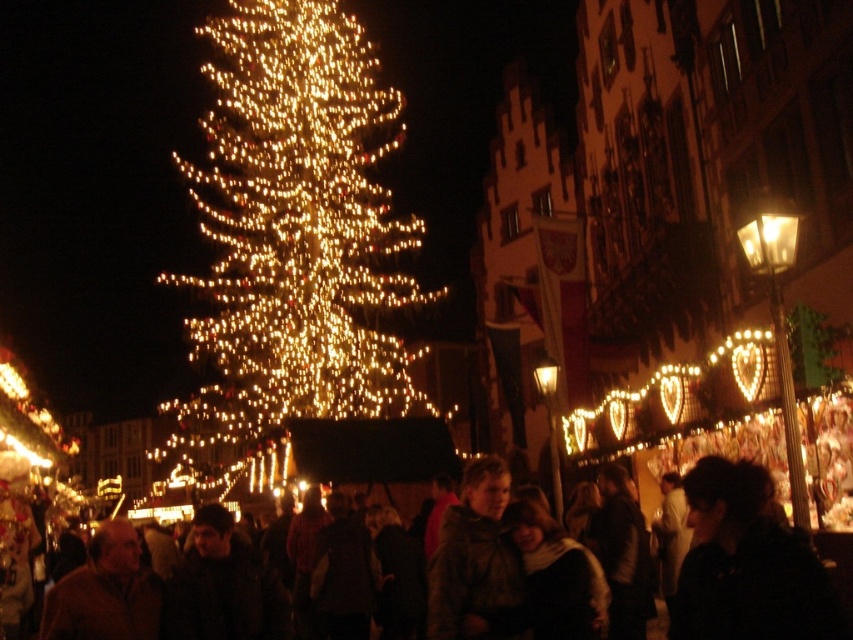
What do you see at coordinates (747, 564) in the screenshot?
I see `dark brown leather jacket at lower center` at bounding box center [747, 564].

Which is more to the left, dark brown leather jacket at lower center or brown fuzzy coat at center?

From the viewer's perspective, dark brown leather jacket at lower center appears more on the left side.

Find the location of a particular element. dark brown leather jacket at lower center is located at coordinates (747, 564).

The width and height of the screenshot is (853, 640). What do you see at coordinates (291, 244) in the screenshot?
I see `illuminated plastic tree at center` at bounding box center [291, 244].

Is point (335, 54) positioned in front of point (750, 628)?

That is False.

Find the location of a particular element. This screenshot has width=853, height=640. illuminated plastic tree at center is located at coordinates (291, 244).

Who is positioned more to the left, illuminated plastic tree at center or brown leather jacket at lower left?

From the viewer's perspective, illuminated plastic tree at center appears more on the left side.

Is point (310, 211) closer to camera compared to point (74, 568)?

No.

Identify the location of illuminated plastic tree at center. (291, 244).